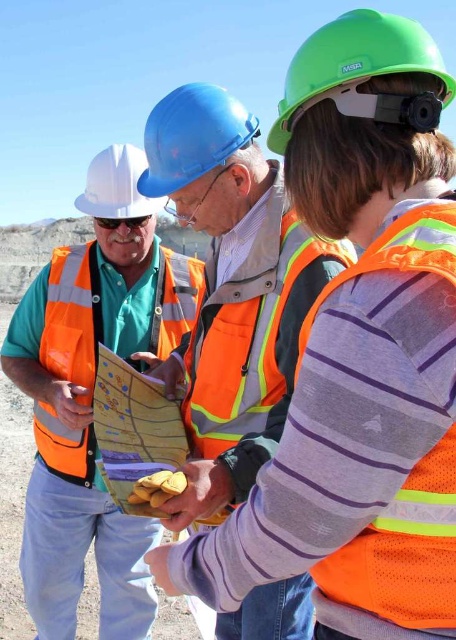
Question: Which of the following is the farthest from the observer?

Choices:
 (A) (182, 163)
 (B) (207, 454)
 (C) (399, 60)

Answer: (B)

Question: Which point is farther from the camera taking this photo?

Choices:
 (A) (x=65, y=428)
 (B) (x=333, y=243)
 (C) (x=150, y=340)
 (D) (x=91, y=168)

Answer: (C)

Question: Is orange mesh safety vest at center in front of matte blue goggles at center?

Choices:
 (A) yes
 (B) no

Answer: (A)

Question: Which of the following is the farthest from the observer?

Choices:
 (A) high-visibility orange safety vest at center
 (B) orange mesh safety vest at center

Answer: (A)

Question: Can you confirm if orange reflective vest at center is positioned above orange reflective vest at left?

Choices:
 (A) yes
 (B) no

Answer: (A)

Question: Can you confirm if orange mesh safety vest at center is wider than reflective orange safety vest at center?

Choices:
 (A) yes
 (B) no

Answer: (B)